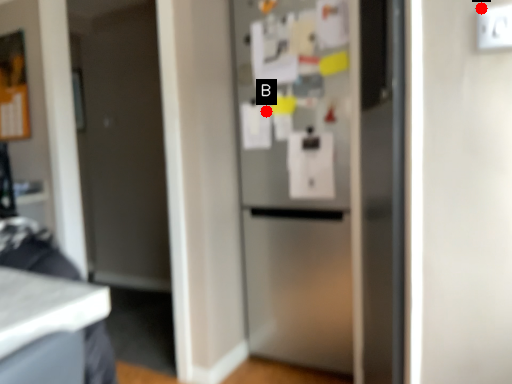
Question: Two points are circled on the image, labeled by A and B beside each circle. Which point is closer to the camera?

Choices:
 (A) A is closer
 (B) B is closer

Answer: (A)